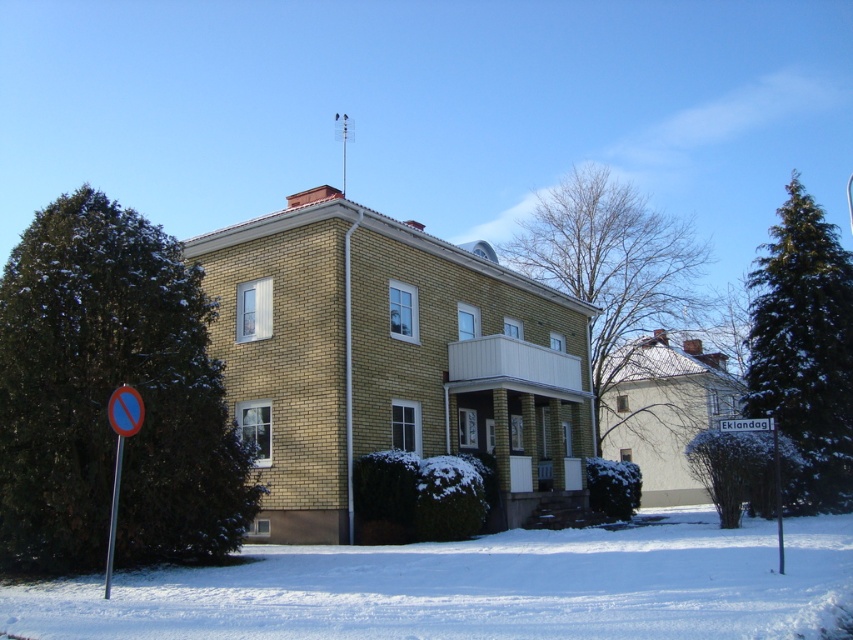
Who is more forward, (12, 508) or (119, 412)?

Point (119, 412) is in front.

This screenshot has height=640, width=853. Describe the element at coordinates (108, 396) in the screenshot. I see `green leafy tree at left` at that location.

This screenshot has width=853, height=640. Find the location of `green leafy tree at left`. green leafy tree at left is located at coordinates (108, 396).

Does green coniferous tree at right appear on the left side of white plastic sign at center?

Incorrect, green coniferous tree at right is not on the left side of white plastic sign at center.

Identify the location of green coniferous tree at right. This screenshot has width=853, height=640. click(804, 349).

I want to click on green coniferous tree at right, so [x=804, y=349].

Does green leafy tree at left have a smaller size compared to metallic pole at center?

Incorrect, green leafy tree at left is not smaller in size than metallic pole at center.

Who is more distant from viewer, (x=146, y=316) or (x=776, y=486)?

The point (x=776, y=486) is behind.

Locate an element on the screen. Image resolution: width=853 pixels, height=640 pixels. green leafy tree at left is located at coordinates (108, 396).